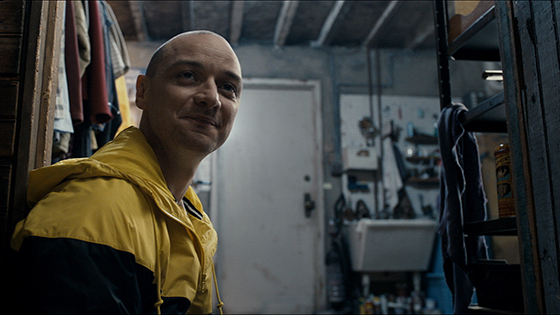
Find the location of a particular element. This screenshot has width=560, height=315. door is located at coordinates (266, 208).